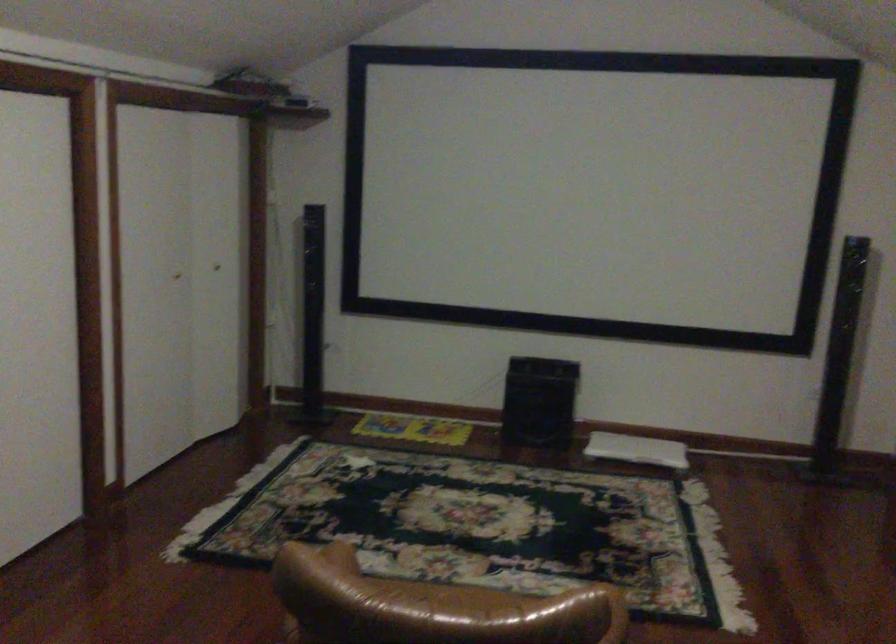
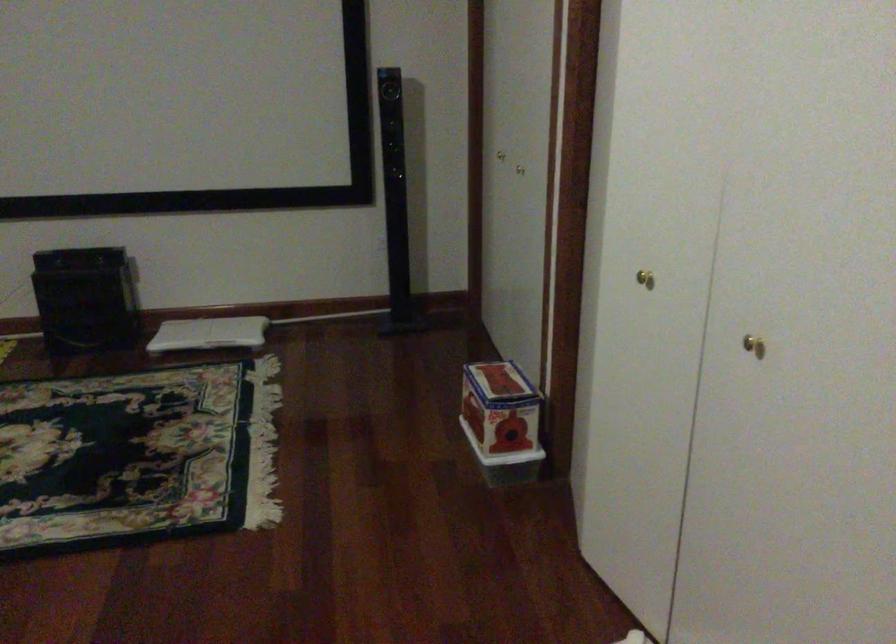
Question: The camera is either moving clockwise (left) or counter-clockwise (right) around the object. The first image is from the beginning of the video and the second image is from the end. Is the camera moving left or right when shooting the video?

Choices:
 (A) Left
 (B) Right

Answer: (A)